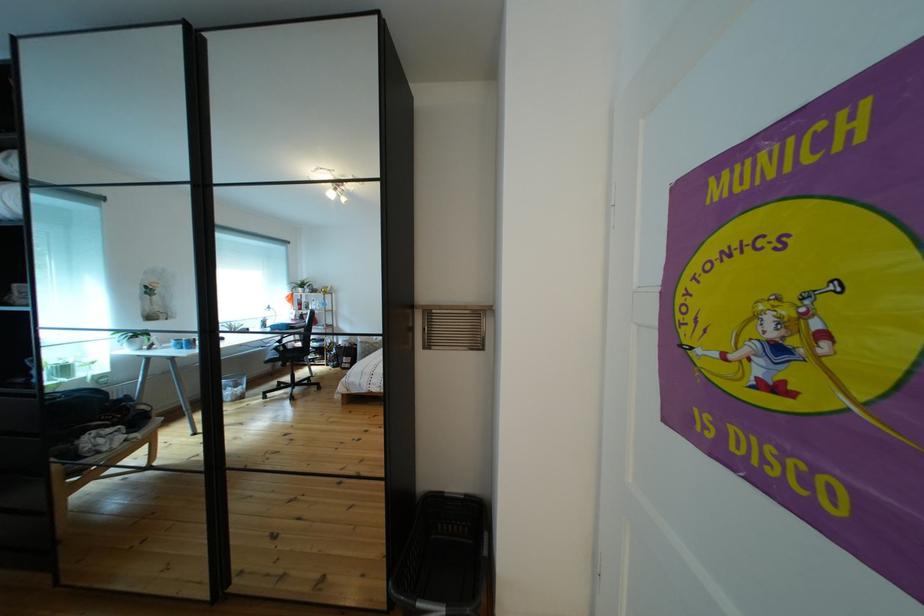
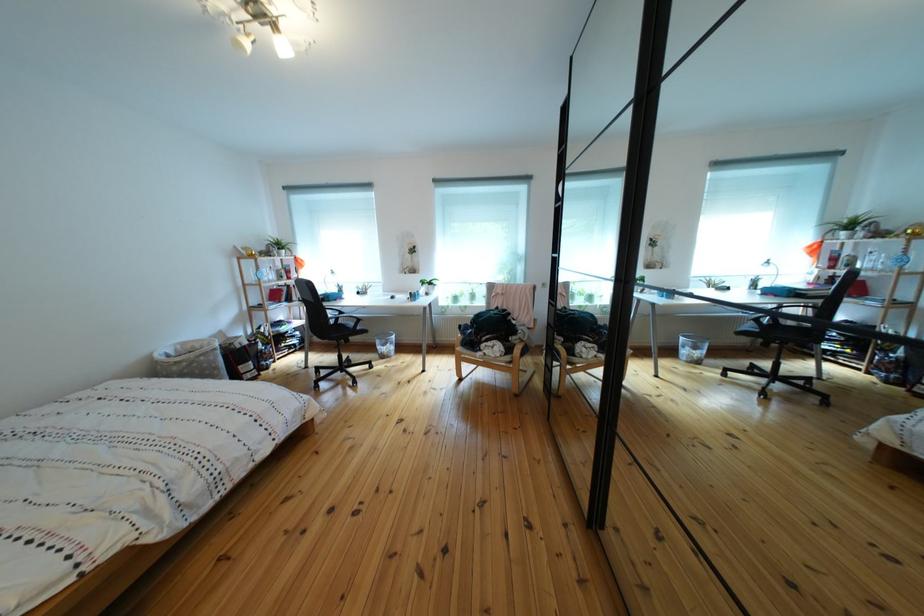
Find the pixel in the second image that matches point 127,402 in the first image.

(613, 329)